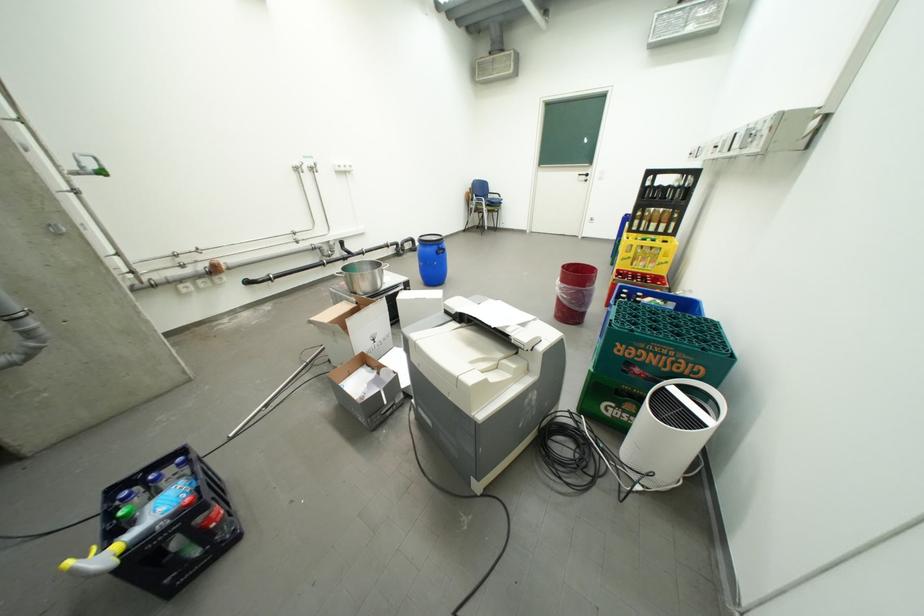
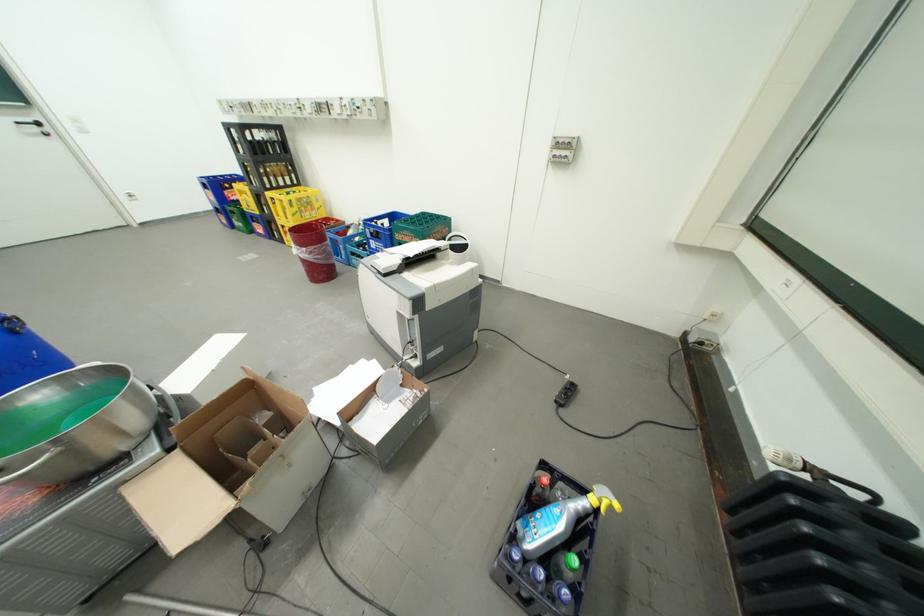
Locate, in the second image, the point that corresponds to point 640,261 in the first image.

(310, 215)